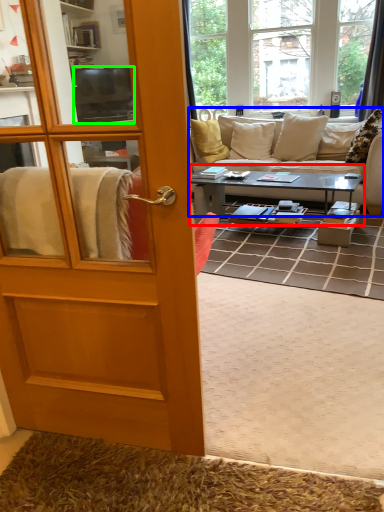
Question: Which object is positioned farthest from coffee table (highlighted by a red box)? Select from studio couch (highlighted by a blue box) and television (highlighted by a green box).

Choices:
 (A) studio couch
 (B) television

Answer: (B)